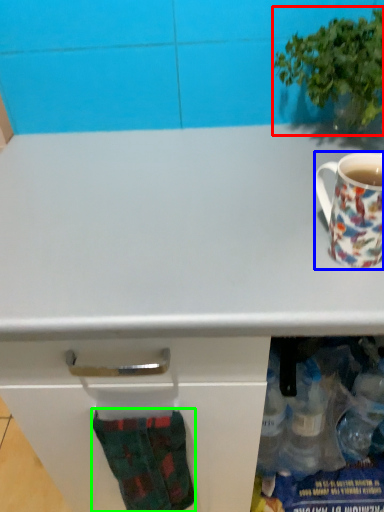
Question: Considering the real-world distances, which object is farthest from houseplant (highlighted by a red box)? coffee cup (highlighted by a blue box) or sock (highlighted by a green box)?

Choices:
 (A) coffee cup
 (B) sock

Answer: (B)